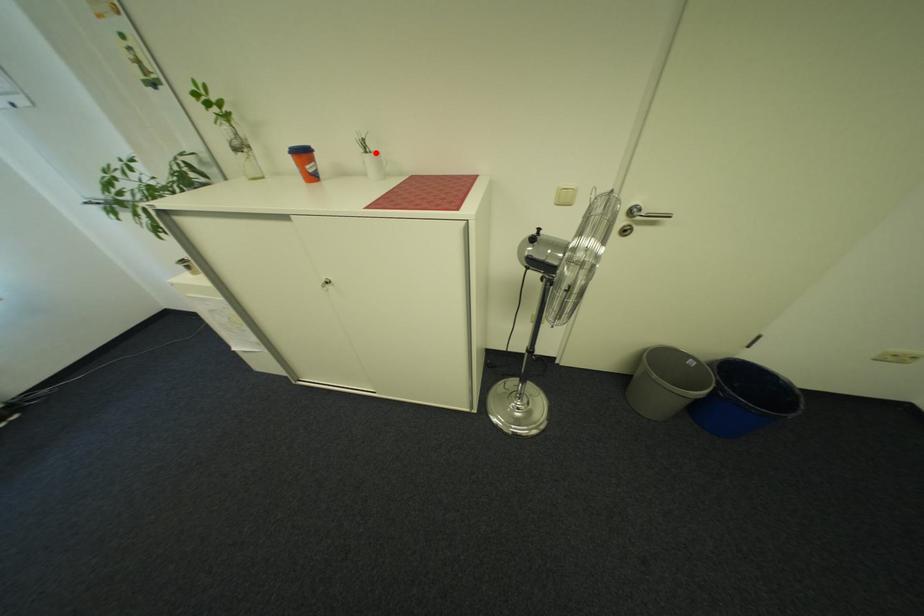
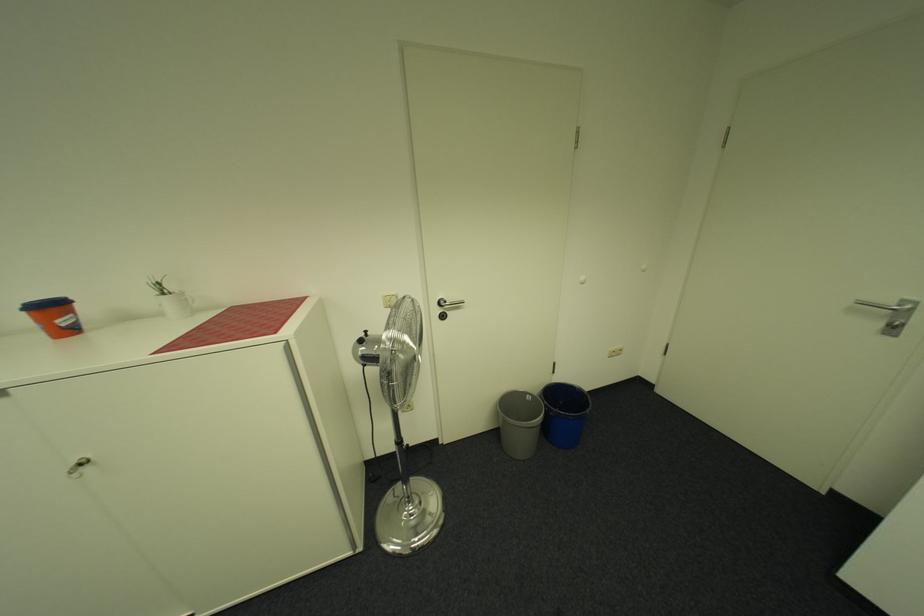
Find the pixel in the second image that matches the highlighted location in the first image.

(173, 294)